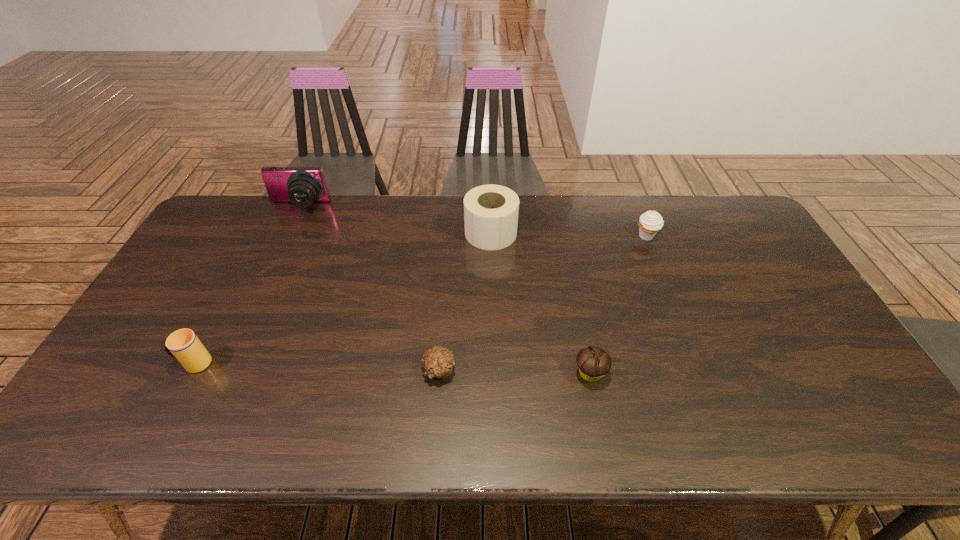
The width and height of the screenshot is (960, 540). What are the coordinates of `free space between the third object from left to right and the toilet tissue` in the screenshot? It's located at (465, 301).

Identify which object is located as the nearest to the fourth object from left to right. Please provide its 2D coordinates. Your answer should be formatted as a tuple, i.e. [(x, y)], where the tuple contains the x and y coordinates of a point satisfying the conditions above.

[(651, 222)]

Image resolution: width=960 pixels, height=540 pixels. What are the coordinates of `the closest object relative to the farthest object` in the screenshot? It's located at (491, 211).

Find the location of a particular element. This screenshot has width=960, height=540. the closest muffin to the farthest muffin is located at coordinates (593, 362).

Identify which muffin is located as the second nearest to the rightmost muffin. Please provide its 2D coordinates. Your answer should be formatted as a tuple, i.e. [(x, y)], where the tuple contains the x and y coordinates of a point satisfying the conditions above.

[(438, 362)]

Image resolution: width=960 pixels, height=540 pixels. In order to click on free spot that satisfies the following two spatial constraints: 1. on the side of the toilet tissue with the handle; 2. on the left side of the cup in this screenshot , I will do pos(262,233).

You are a GUI agent. You are given a task and a screenshot of the screen. Output one action in this format:
    pyautogui.click(x=<x>, y=<y>)
    Task: Click on the blank space that satisfies the following two spatial constraints: 1. on the side of the cup with the handle; 2. on the back side of the rightmost object
    The height and width of the screenshot is (540, 960).
    Given the screenshot: What is the action you would take?
    pyautogui.click(x=261, y=236)

The height and width of the screenshot is (540, 960). What are the coordinates of `free spot that satisfies the following two spatial constraints: 1. on the side of the farthest muffin with the handle; 2. on the right side of the cup` in the screenshot? It's located at (261, 236).

Where is `vacant area in the image that satisfies the following two spatial constraints: 1. on the side of the cup with the handle; 2. on the left side of the toilet tissue`? The height and width of the screenshot is (540, 960). vacant area in the image that satisfies the following two spatial constraints: 1. on the side of the cup with the handle; 2. on the left side of the toilet tissue is located at coordinates (262, 233).

Where is `vacant space that satisfies the following two spatial constraints: 1. on the front side of the fifth tallest object; 2. on the left side of the toilet tissue`? This screenshot has height=540, width=960. vacant space that satisfies the following two spatial constraints: 1. on the front side of the fifth tallest object; 2. on the left side of the toilet tissue is located at coordinates (494, 373).